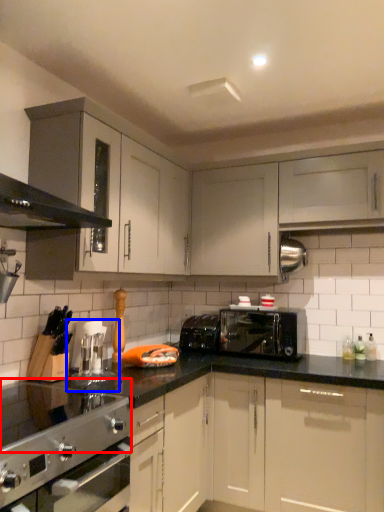
Question: Among these objects, which one is nearest to the camera, gas stove (highlighted by a red box) or coffee machine (highlighted by a blue box)?

Choices:
 (A) gas stove
 (B) coffee machine

Answer: (A)